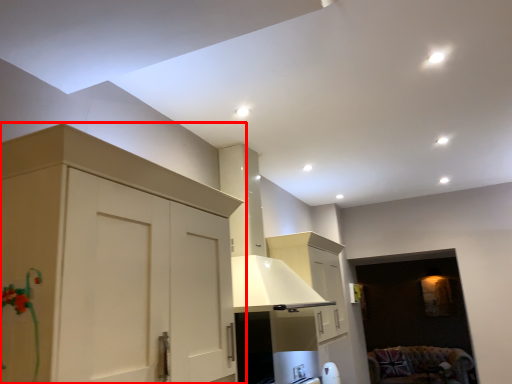
Question: From the image's perspective, what is the correct spatial positioning of cabinetry (annotated by the red box) in reference to furniture?

Choices:
 (A) above
 (B) below

Answer: (A)